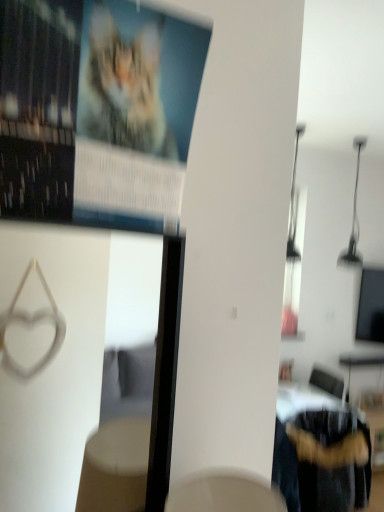
The width and height of the screenshot is (384, 512). Describe the element at coordinates (320, 451) in the screenshot. I see `fuzzy fabric chair at lower right` at that location.

Locate an element on the screen. fuzzy fabric chair at lower right is located at coordinates (320, 451).

The height and width of the screenshot is (512, 384). Find the location of `matte paper poster at upper left`. matte paper poster at upper left is located at coordinates (96, 111).

What do you see at coordinates (96, 111) in the screenshot? This screenshot has width=384, height=512. I see `matte paper poster at upper left` at bounding box center [96, 111].

The image size is (384, 512). Find the location of `fuzzy fabric chair at lower right`. fuzzy fabric chair at lower right is located at coordinates (320, 451).

Considering the relative positions of matte paper poster at upper left and fuzzy fabric chair at lower right in the image provided, is matte paper poster at upper left to the left or to the right of fuzzy fabric chair at lower right?

From the image, it's evident that matte paper poster at upper left is to the left of fuzzy fabric chair at lower right.

In the image, is matte paper poster at upper left positioned in front of or behind fuzzy fabric chair at lower right?

In the image, matte paper poster at upper left appears in front of fuzzy fabric chair at lower right.

Is point (170, 28) positioned after point (364, 469)?

That is False.

From the image's perspective, is matte paper poster at upper left located above or below fuzzy fabric chair at lower right?

matte paper poster at upper left is above fuzzy fabric chair at lower right.

From a real-world perspective, between matte paper poster at upper left and fuzzy fabric chair at lower right, who is vertically lower?

From a 3D spatial view, fuzzy fabric chair at lower right is below.

Which object is thinner, matte paper poster at upper left or fuzzy fabric chair at lower right?

matte paper poster at upper left is thinner.

Considering the relative sizes of matte paper poster at upper left and fuzzy fabric chair at lower right in the image provided, is matte paper poster at upper left taller than fuzzy fabric chair at lower right?

No.

Considering the sizes of objects matte paper poster at upper left and fuzzy fabric chair at lower right in the image provided, who is bigger, matte paper poster at upper left or fuzzy fabric chair at lower right?

fuzzy fabric chair at lower right is bigger.

Does matte paper poster at upper left contain fuzzy fabric chair at lower right?

No, matte paper poster at upper left does not contain fuzzy fabric chair at lower right.

Are matte paper poster at upper left and fuzzy fabric chair at lower right making contact?

They are not placed beside each other.

Could you tell me if matte paper poster at upper left is facing fuzzy fabric chair at lower right?

No, matte paper poster at upper left does not turn towards fuzzy fabric chair at lower right.

What's the angular difference between matte paper poster at upper left and fuzzy fabric chair at lower right's facing directions?

159 degrees.

How distant is matte paper poster at upper left from fuzzy fabric chair at lower right?

matte paper poster at upper left is 7.35 feet away from fuzzy fabric chair at lower right.

At what (x,y) coordinates should I click in order to perform the action: click on furniture below the matte paper poster at upper left (from the image's perspective). Please return your answer as a coordinate pair (x, y). Looking at the image, I should click on (320, 451).

Considering the positions of objects fuzzy fabric chair at lower right and matte paper poster at upper left in the image provided, who is more to the left, fuzzy fabric chair at lower right or matte paper poster at upper left?

matte paper poster at upper left.

Which object is further away from the camera taking this photo, fuzzy fabric chair at lower right or matte paper poster at upper left?

fuzzy fabric chair at lower right is behind.

Is point (319, 473) positioned in front of point (78, 124)?

No, it is not.

From the image's perspective, which is below, fuzzy fabric chair at lower right or matte paper poster at upper left?

fuzzy fabric chair at lower right appears lower in the image.

From a real-world perspective, does fuzzy fabric chair at lower right stand above matte paper poster at upper left?

No, from a real-world perspective, fuzzy fabric chair at lower right is not over matte paper poster at upper left

Considering the relative sizes of fuzzy fabric chair at lower right and matte paper poster at upper left in the image provided, is fuzzy fabric chair at lower right wider than matte paper poster at upper left?

Yes, fuzzy fabric chair at lower right is wider than matte paper poster at upper left.

Is fuzzy fabric chair at lower right taller or shorter than matte paper poster at upper left?

Considering their sizes, fuzzy fabric chair at lower right has more height than matte paper poster at upper left.

Considering the relative sizes of fuzzy fabric chair at lower right and matte paper poster at upper left in the image provided, is fuzzy fabric chair at lower right bigger than matte paper poster at upper left?

Correct, fuzzy fabric chair at lower right is larger in size than matte paper poster at upper left.

Would you say fuzzy fabric chair at lower right is inside or outside matte paper poster at upper left?

fuzzy fabric chair at lower right is outside matte paper poster at upper left.

Is fuzzy fabric chair at lower right not near matte paper poster at upper left?

Yes, fuzzy fabric chair at lower right and matte paper poster at upper left are located far from each other.

Is fuzzy fabric chair at lower right facing away from matte paper poster at upper left?

No.

What's the angular difference between fuzzy fabric chair at lower right and matte paper poster at upper left's facing directions?

The facing directions of fuzzy fabric chair at lower right and matte paper poster at upper left are 159 degrees apart.

How distant is fuzzy fabric chair at lower right from matte paper poster at upper left?

fuzzy fabric chair at lower right and matte paper poster at upper left are 2.24 meters apart from each other.

You are a GUI agent. You are given a task and a screenshot of the screen. Output one action in this format:
    pyautogui.click(x=<x>, y=<y>)
    Task: Click on the poster page on the left of fuzzy fabric chair at lower right
    The height and width of the screenshot is (512, 384).
    Given the screenshot: What is the action you would take?
    (96, 111)

Locate an element on the screen. furniture on the right side of matte paper poster at upper left is located at coordinates (320, 451).

At what (x,y) coordinates should I click in order to perform the action: click on poster page on the left of fuzzy fabric chair at lower right. Please return your answer as a coordinate pair (x, y). Looking at the image, I should click on (96, 111).